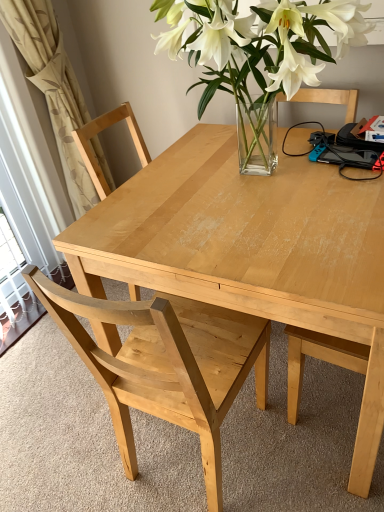
Question: Is beige fabric curtain at left wider or thinner than natural wood table at center?

Choices:
 (A) thin
 (B) wide

Answer: (A)

Question: From a real-world perspective, is beige fabric curtain at left above or below natural wood table at center?

Choices:
 (A) above
 (B) below

Answer: (A)

Question: Which is nearer to the natural wood table at center?

Choices:
 (A) light wood chair at center
 (B) beige fabric curtain at left

Answer: (A)

Question: Which object is positioned closest to the beige fabric curtain at left?

Choices:
 (A) natural wood table at center
 (B) light wood chair at center

Answer: (A)